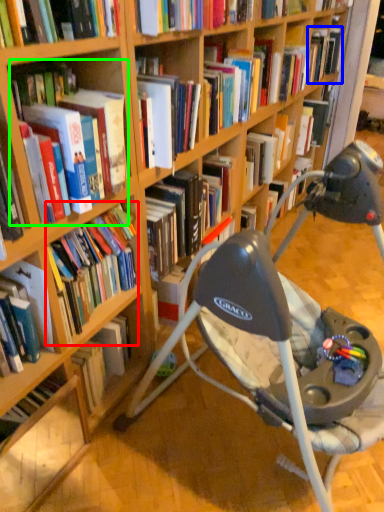
Question: Which is nearer to the book (highlighted by a red box)? book (highlighted by a blue box) or book (highlighted by a green box).

Choices:
 (A) book
 (B) book

Answer: (B)